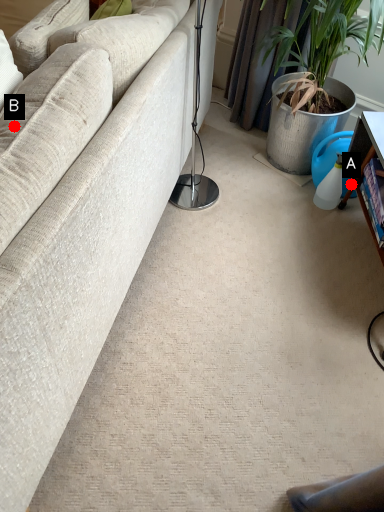
Question: Two points are circled on the image, labeled by A and B beside each circle. Which point is closer to the camera taking this photo?

Choices:
 (A) A is closer
 (B) B is closer

Answer: (B)